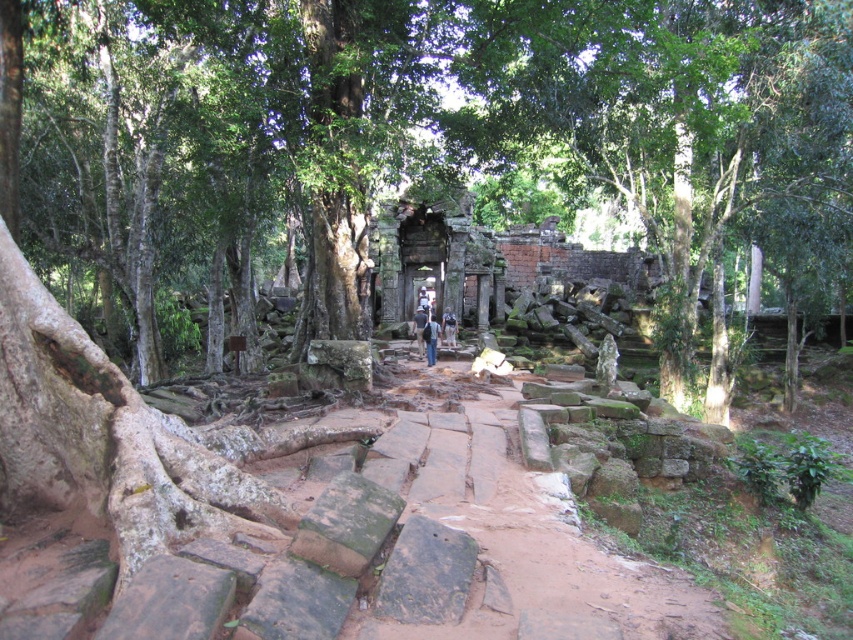
You are an archaeologist exploring the ancient stone structure and notice a brown leather backpack at center. Where exactly is the brown leather backpack positioned relative to the path and the central area of the ruins?

The brown leather backpack at center is located at point coordinates approximately 0.512 on the x axis and 0.492 on the y axis, which is very close to the center of the image, suggesting it is near the central area of the ruins and the path leading towards it.

You are standing on the rugged path in front of the ancient stone structure. You notice the dark blue jeans at center and the brown leather backpack at center. Which object is nearer to you?

The dark blue jeans at center is closer to the viewer than the brown leather backpack at center.

You are standing at the entrance of the ancient stone structure and notice a green rough bark tree at center and dark blue jeans at center. Which object is nearer to you?

The green rough bark tree at center is closer to the viewer than the dark blue jeans at center, so the tree is nearer.